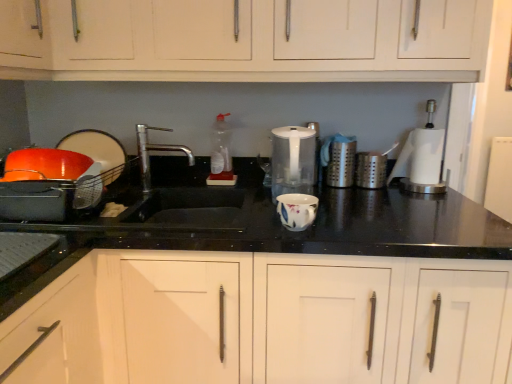
Question: Is satin silver canister at center, the 2th appliance in the right-to-left sequence, further to camera compared to white matte cabinet at upper center, which is the first cabinetry from top to bottom?

Choices:
 (A) no
 (B) yes

Answer: (B)

Question: Is satin silver canister at center, the 2th appliance in the right-to-left sequence, far away from white matte cabinet at upper center, arranged as the second cabinetry when ordered from the bottom?

Choices:
 (A) no
 (B) yes

Answer: (A)

Question: Would you say satin silver canister at center, the 2th appliance in the right-to-left sequence, contains white matte cabinet at upper center, arranged as the second cabinetry when ordered from the bottom?

Choices:
 (A) yes
 (B) no

Answer: (B)

Question: Can you confirm if satin silver canister at center, the 2th appliance in the right-to-left sequence, is thinner than white matte cabinet at upper center, which is the first cabinetry from top to bottom?

Choices:
 (A) yes
 (B) no

Answer: (A)

Question: From the image's perspective, is satin silver canister at center, the 4th appliance when ordered from left to right, located above white matte cabinet at upper center, which is the first cabinetry from top to bottom?

Choices:
 (A) no
 (B) yes

Answer: (A)

Question: In the image, is satin silver canister at center, the 2th appliance in the right-to-left sequence, positioned in front of or behind white matte cabinet at upper center, which is the first cabinetry from top to bottom?

Choices:
 (A) front
 (B) behind

Answer: (B)

Question: In terms of height, does satin silver canister at center, the 2th appliance in the right-to-left sequence, look taller or shorter compared to white matte cabinet at upper center, which is the first cabinetry from top to bottom?

Choices:
 (A) short
 (B) tall

Answer: (A)

Question: Is satin silver canister at center, the 4th appliance when ordered from left to right, wider or thinner than white matte cabinet at upper center, arranged as the second cabinetry when ordered from the bottom?

Choices:
 (A) wide
 (B) thin

Answer: (B)

Question: Considering the positions of point (351, 160) and point (300, 26), is point (351, 160) closer or farther from the camera than point (300, 26)?

Choices:
 (A) farther
 (B) closer

Answer: (A)

Question: From a real-world perspective, relative to satin silver canister at center, the 2th appliance in the right-to-left sequence, is clear plastic bottle at center vertically above or below?

Choices:
 (A) below
 (B) above

Answer: (B)

Question: Is clear plastic bottle at center bigger or smaller than satin silver canister at center, the 2th appliance in the right-to-left sequence?

Choices:
 (A) big
 (B) small

Answer: (A)

Question: Would you say clear plastic bottle at center is to the left or to the right of satin silver canister at center, the 4th appliance when ordered from left to right, in the picture?

Choices:
 (A) right
 (B) left

Answer: (B)

Question: Is point (218, 130) positioned closer to the camera than point (334, 170)?

Choices:
 (A) farther
 (B) closer

Answer: (A)

Question: Considering the positions of matte black bowl at left, which appears as the 2th appliance when viewed from the left, and satin silver canister at center right, the first appliance viewed from the right, in the image, is matte black bowl at left, which appears as the 2th appliance when viewed from the left, bigger or smaller than satin silver canister at center right, the first appliance viewed from the right,?

Choices:
 (A) big
 (B) small

Answer: (A)

Question: From the image's perspective, relative to satin silver canister at center right, the first appliance viewed from the right, is matte black bowl at left, which is counted as the fourth appliance, starting from the right, above or below?

Choices:
 (A) below
 (B) above

Answer: (B)